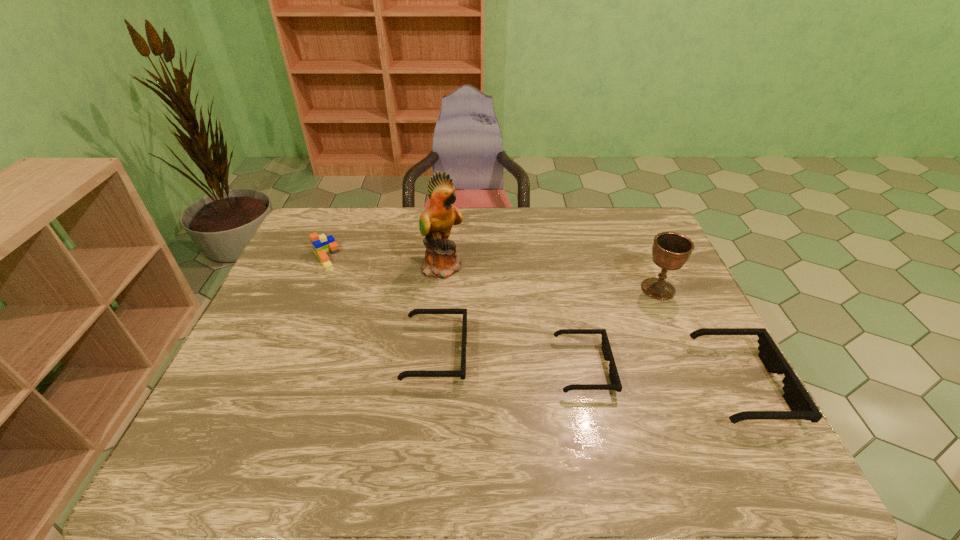
In order to click on vacant space that satisfies the following two spatial constraints: 1. on the front-facing side of the fifth shortest object; 2. on the right side of the tallest object in this screenshot , I will do `click(441, 289)`.